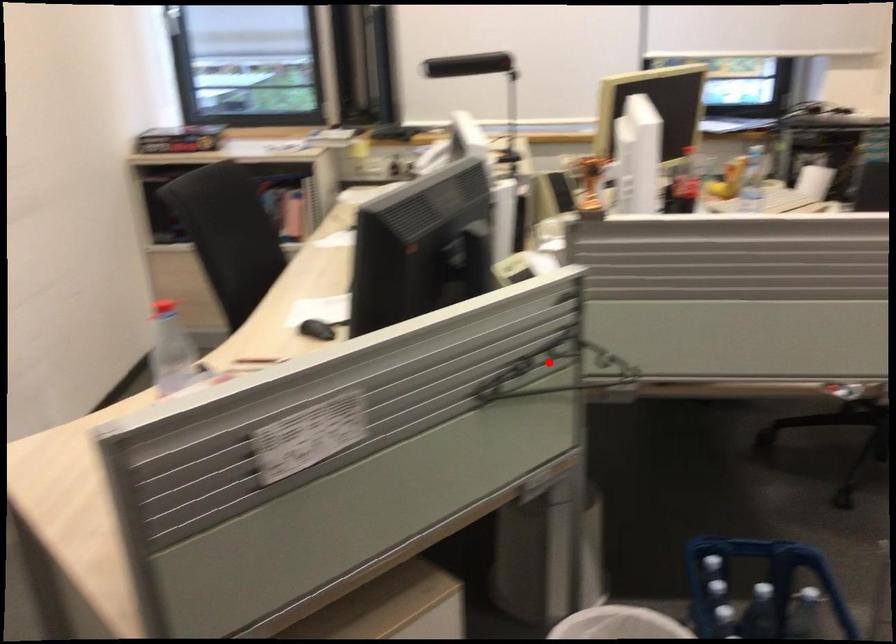
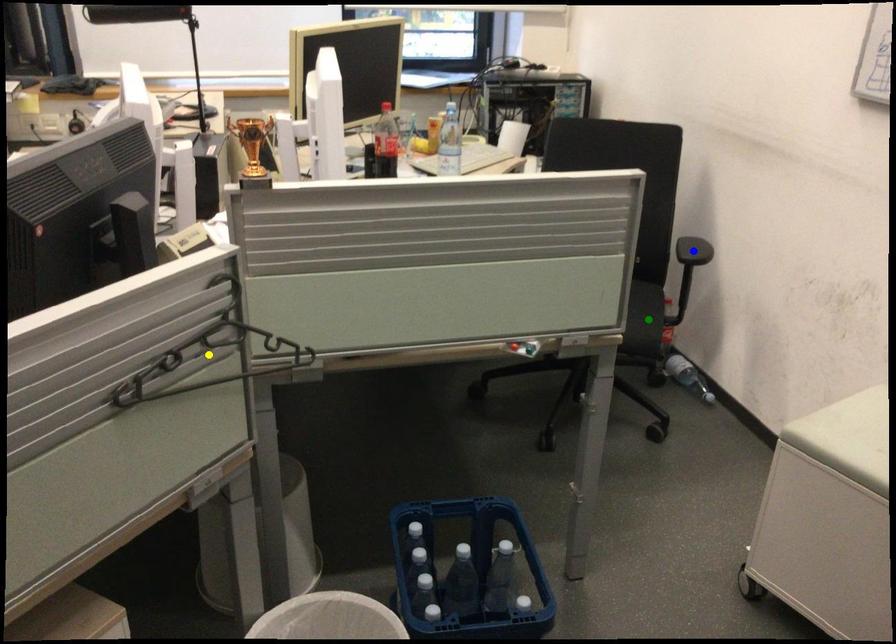
Question: I am providing you with two images of the same scene from different viewpoints. A red point is marked on the first image. You are given multiple points on the second image. Can you choose the point in image 2 that corresponds to the point in image 1?

Choices:
 (A) blue point
 (B) green point
 (C) yellow point

Answer: (C)